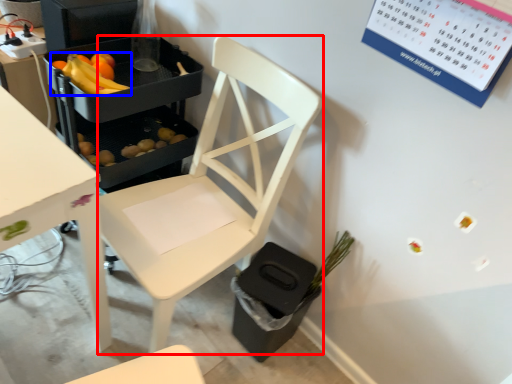
Question: Which object appears closest to the camera in this image, chair (highlighted by a red box) or banana (highlighted by a blue box)?

Choices:
 (A) chair
 (B) banana

Answer: (A)